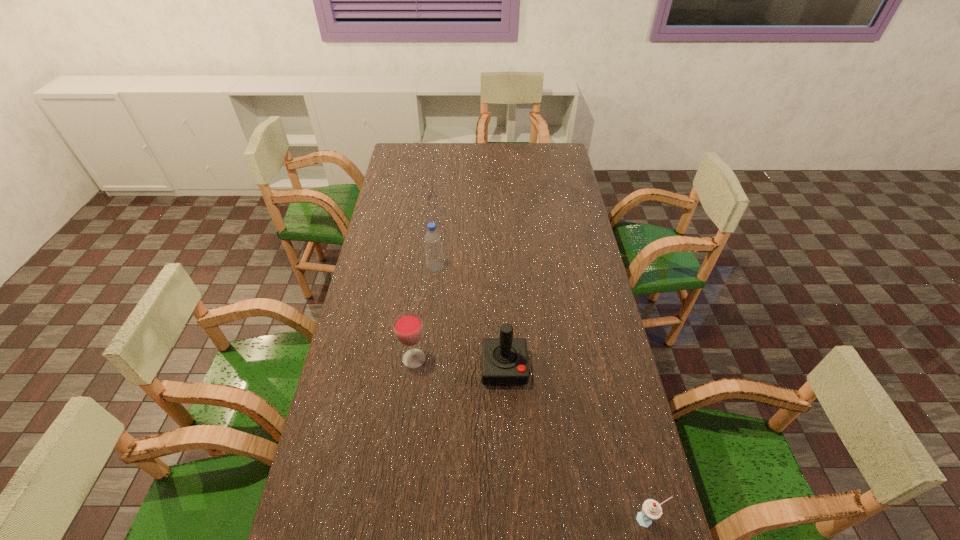
Identify the location of free space between the wineglass and the third object from left to right. (459, 363).

Where is `empty location between the rightmost object and the third object from left to right`? The image size is (960, 540). empty location between the rightmost object and the third object from left to right is located at coordinates (576, 443).

Locate an element on the screen. The width and height of the screenshot is (960, 540). free space between the shortest object and the farthest object is located at coordinates (541, 394).

Locate an element on the screen. Image resolution: width=960 pixels, height=540 pixels. object that can be found as the closest to the rightmost object is located at coordinates (504, 360).

Identify which object is the closest to the wineglass. Please provide its 2D coordinates. Your answer should be formatted as a tuple, i.e. [(x, y)], where the tuple contains the x and y coordinates of a point satisfying the conditions above.

[(504, 360)]